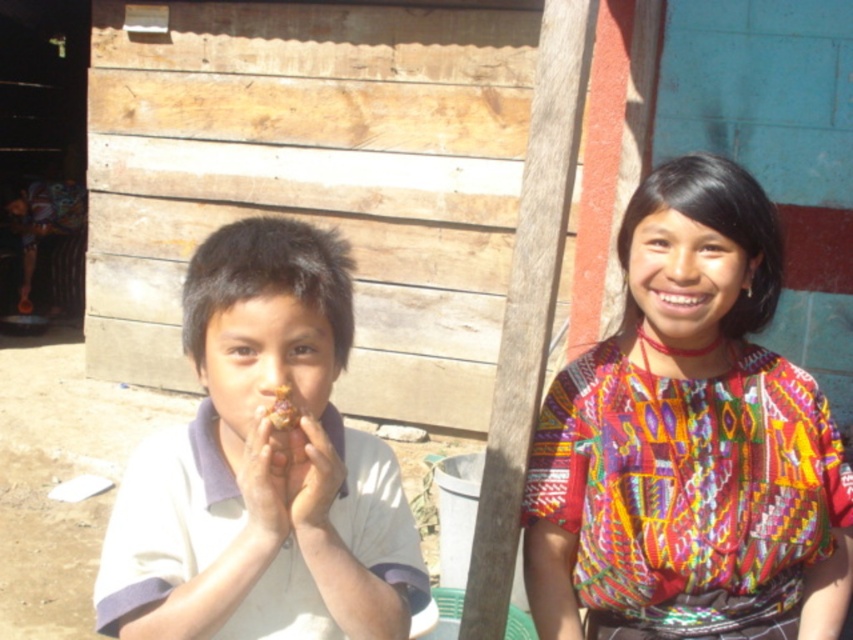
Who is lower down, white cotton shirt at left or yellow matte food at center?

white cotton shirt at left is lower down.

Does point (285, 630) come farther from viewer compared to point (286, 394)?

Yes.

Identify the location of white cotton shirt at left. The height and width of the screenshot is (640, 853). (262, 467).

Find the location of a particular element. This screenshot has height=640, width=853. multicolored woven blouse at right is located at coordinates (689, 442).

Identify the location of multicolored woven blouse at right. (689, 442).

The height and width of the screenshot is (640, 853). In order to click on multicolored woven blouse at right in this screenshot , I will do `click(689, 442)`.

Which of these two, multicolored woven blouse at right or yellow matte food at center, stands shorter?

yellow matte food at center is shorter.

Is the position of multicolored woven blouse at right less distant than that of yellow matte food at center?

No.

The image size is (853, 640). What do you see at coordinates (689, 442) in the screenshot? I see `multicolored woven blouse at right` at bounding box center [689, 442].

Identify the location of multicolored woven blouse at right. This screenshot has width=853, height=640. (689, 442).